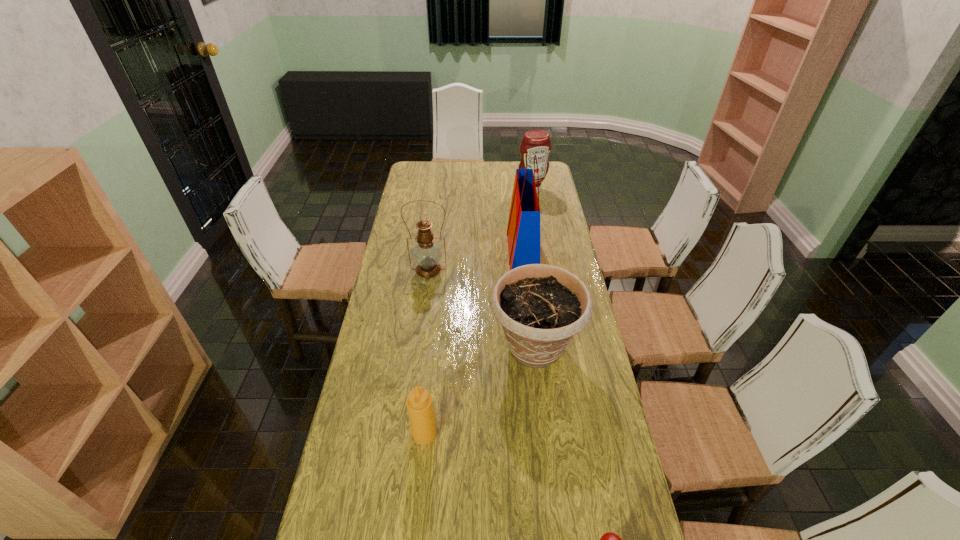
Locate an element on the screen. The image size is (960, 540). object identified as the fourth closest to the nearest condiment is located at coordinates (427, 254).

Locate an element on the screen. condiment object that ranks as the second closest to the nearest condiment is located at coordinates (535, 142).

Identify which condiment is the nearest to the leftmost condiment. Please provide its 2D coordinates. Your answer should be formatted as a tuple, i.e. [(x, y)], where the tuple contains the x and y coordinates of a point satisfying the conditions above.

[(609, 539)]

This screenshot has height=540, width=960. Find the location of `vacant area in the image that satisfies the following two spatial constraints: 1. on the handle side of the flowerpot; 2. on the right side of the tallest object`. vacant area in the image that satisfies the following two spatial constraints: 1. on the handle side of the flowerpot; 2. on the right side of the tallest object is located at coordinates (533, 347).

Find the location of a particular element. Image resolution: width=960 pixels, height=540 pixels. free region that satisfies the following two spatial constraints: 1. on the back side of the farthest object; 2. on the right side of the second nearest object is located at coordinates (449, 190).